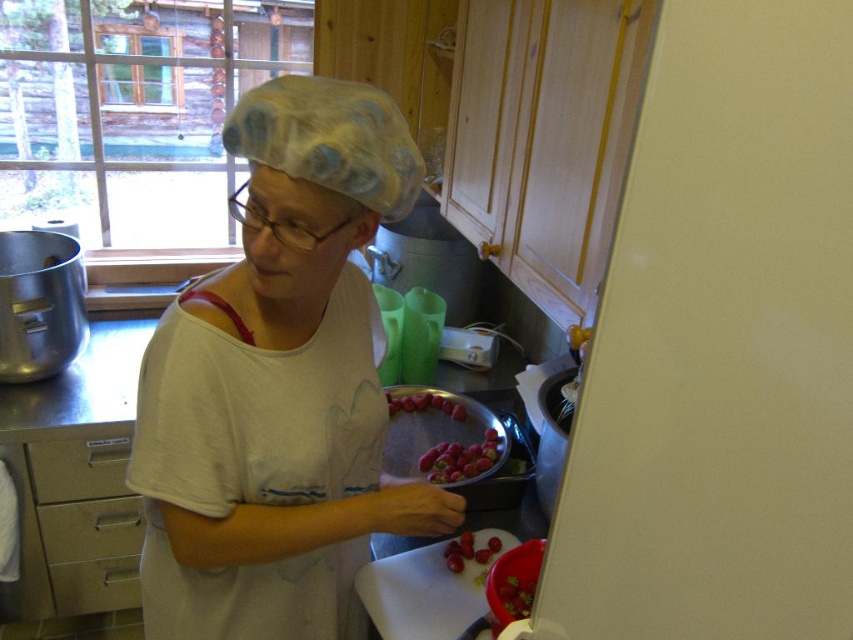
Based on the photo, you are arranging fruits on a counter and need to place the ripe red grapes at center and the shiny red strawberries at lower center. According to the image, which fruit is positioned to the left of the other?

The ripe red grapes at center is positioned on the left side of shiny red strawberries at lower center.

In the kitchen scene, there is a metallic silver drawer at lower left and shiny red strawberries at center. Which object is positioned to the left of the other?

The metallic silver drawer at lower left is positioned to the left of shiny red strawberries at center.

You are a chef preparing a fruit platter and need to place both the white matte hairnet at upper center and the shiny red strawberries at lower center on a shelf. The shelf has a width of 15 cm. Can both items fit side by side on the shelf without overlapping?

The white matte hairnet at upper center has a larger width than the shiny red strawberries at lower center. However, since the exact widths are not provided, it is impossible to determine if both items can fit on the 15 cm shelf without overlapping. Additional measurements are needed.